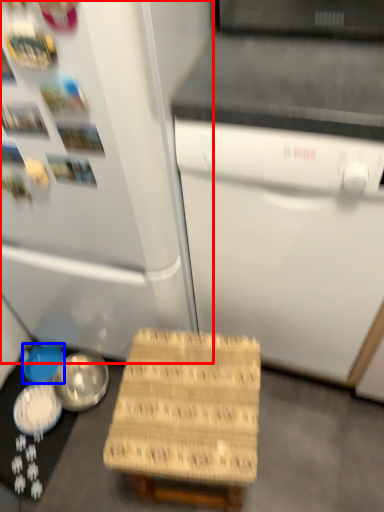
Question: Among these objects, which one is farthest to the camera, refrigerator (highlighted by a red box) or bowl (highlighted by a blue box)?

Choices:
 (A) refrigerator
 (B) bowl

Answer: (B)